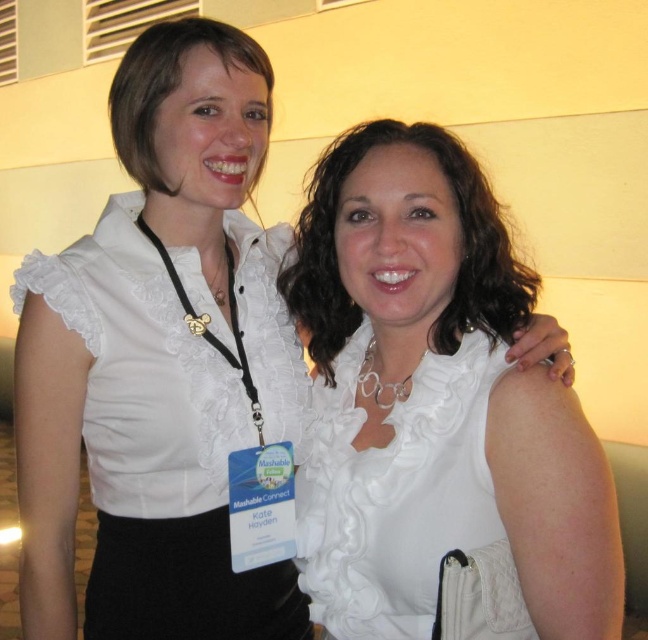
You are a photographer standing 33 inches away from the camera. You want to take a photo of the white satin blouse at center. Is your current distance sufficient to capture the entire blouse in the frame?

The white satin blouse at center and camera are 33.46 inches apart. Since you are standing 33 inches away from the camera, you are close enough to capture the entire blouse in the frame.

You are a fashion designer observing the image and need to determine which garment has a wider silhouette between the white satin blouse at upper left and the white satin dress at center. Based on the description, which one is wider?

The white satin blouse at upper left is wider than the white satin dress at center according to the description.